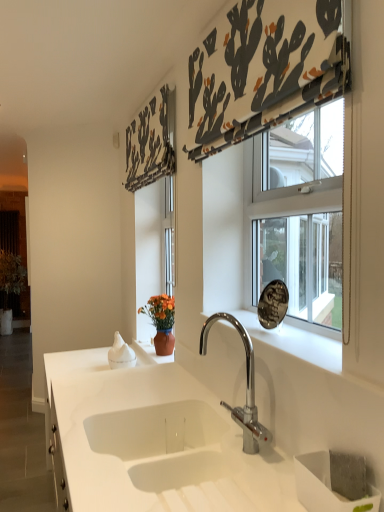
Question: Should I look upward or downward to see white marble window sill at center?

Choices:
 (A) up
 (B) down

Answer: (B)

Question: Is white matte sink at center smaller than white marble window sill at center?

Choices:
 (A) yes
 (B) no

Answer: (B)

Question: Can you confirm if white matte sink at center is positioned to the right of white marble window sill at center?

Choices:
 (A) no
 (B) yes

Answer: (A)

Question: Does white matte sink at center have a lesser width compared to white marble window sill at center?

Choices:
 (A) no
 (B) yes

Answer: (A)

Question: Is the depth of white matte sink at center less than that of white marble window sill at center?

Choices:
 (A) no
 (B) yes

Answer: (B)

Question: From the image's perspective, is white matte sink at center on white marble window sill at center?

Choices:
 (A) no
 (B) yes

Answer: (A)

Question: From a real-world perspective, is white matte sink at center beneath white marble window sill at center?

Choices:
 (A) yes
 (B) no

Answer: (A)

Question: Considering the relative sizes of black fabric with cactus print at upper center, arranged as the 1th curtain when viewed from the back, and white marble window sill at center in the image provided, is black fabric with cactus print at upper center, arranged as the 1th curtain when viewed from the back, smaller than white marble window sill at center?

Choices:
 (A) yes
 (B) no

Answer: (B)

Question: Is black fabric with cactus print at upper center, arranged as the second curtain when viewed from the front, oriented away from white marble window sill at center?

Choices:
 (A) no
 (B) yes

Answer: (A)

Question: Is black fabric with cactus print at upper center, arranged as the 1th curtain when viewed from the back, wider than white marble window sill at center?

Choices:
 (A) no
 (B) yes

Answer: (A)

Question: From a real-world perspective, is black fabric with cactus print at upper center, arranged as the second curtain when viewed from the front, below white marble window sill at center?

Choices:
 (A) yes
 (B) no

Answer: (B)

Question: Considering the relative sizes of black fabric with cactus print at upper center, which ranks as the first curtain in left-to-right order, and white marble window sill at center in the image provided, is black fabric with cactus print at upper center, which ranks as the first curtain in left-to-right order, bigger than white marble window sill at center?

Choices:
 (A) no
 (B) yes

Answer: (B)

Question: Is black fabric with cactus print at upper center, arranged as the 1th curtain when viewed from the back, beside white marble window sill at center?

Choices:
 (A) no
 (B) yes

Answer: (A)

Question: Does white fabric with cactus print at upper center, the first curtain when ordered from front to back, contain wooden screen door at left?

Choices:
 (A) no
 (B) yes

Answer: (A)